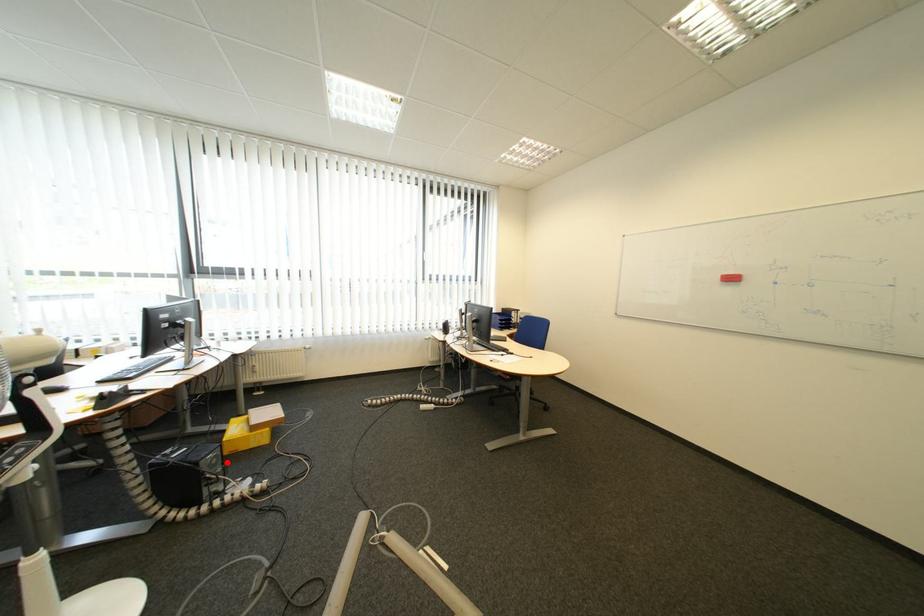
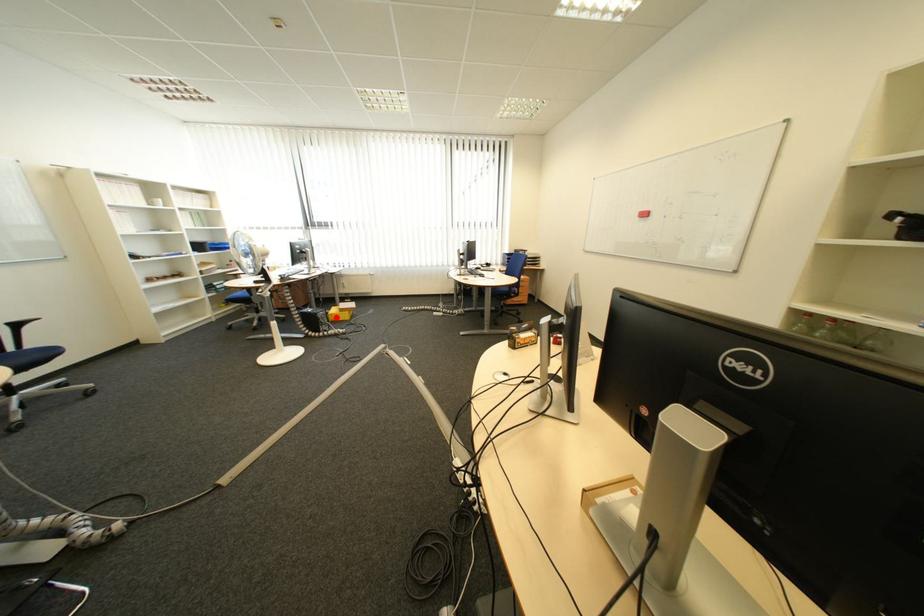
I am providing you with two images of the same scene from different viewpoints. A red point is marked on the first image and another point is marked on the second image. Do the highlighted points in image1 and image2 indicate the same real-world spot?

Yes